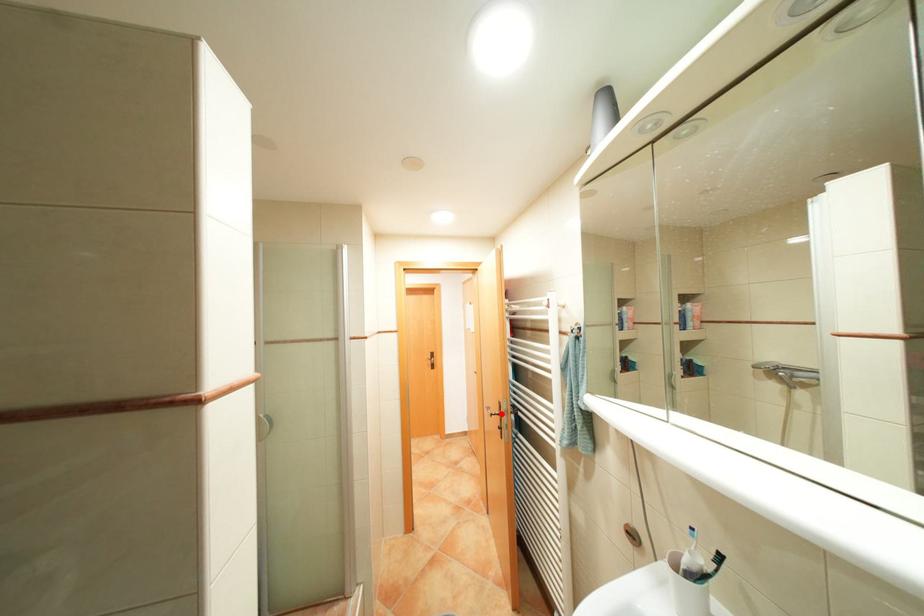
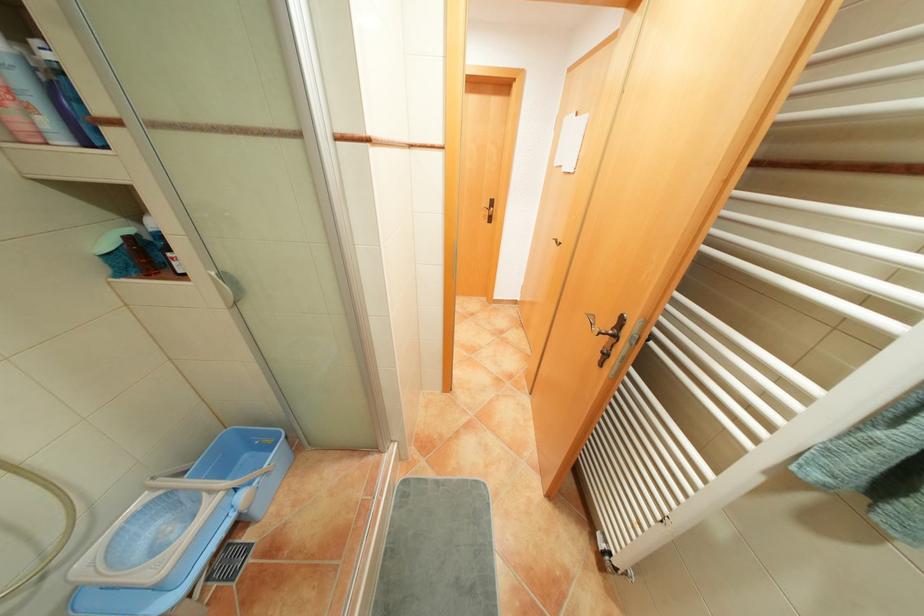
The point at the highlighted location is marked in the first image. Where is the corresponding point in the second image?

(609, 333)